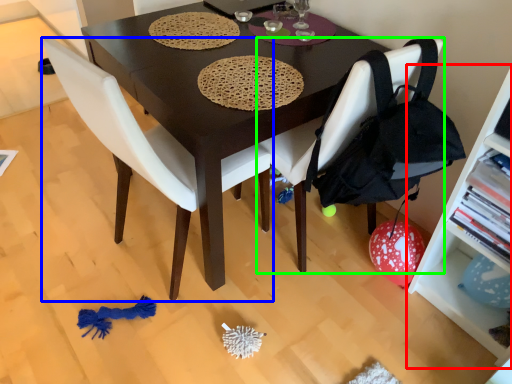
Question: Estimate the real-world distances between objects in this image. Which object is closer to shelf (highlighted by a red box), chair (highlighted by a blue box) or chair (highlighted by a green box)?

Choices:
 (A) chair
 (B) chair

Answer: (B)